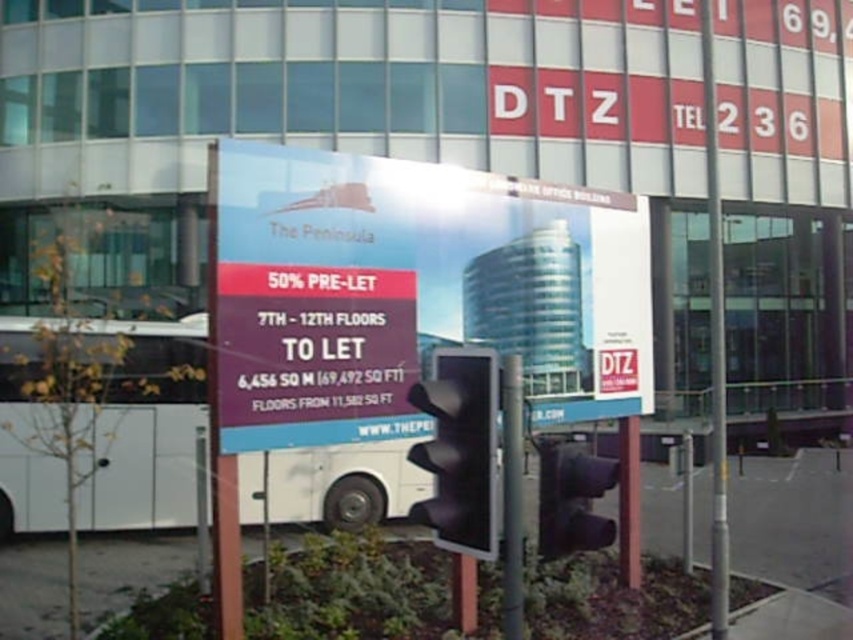
What do you see at coordinates (415, 292) in the screenshot? I see `white glossy billboard at center` at bounding box center [415, 292].

At what (x,y) coordinates should I click in order to perform the action: click on white glossy billboard at center. Please return your answer as a coordinate pair (x, y). Looking at the image, I should click on (415, 292).

Does point (346, 264) lie in front of point (717, 554)?

Yes, point (346, 264) is in front of point (717, 554).

This screenshot has height=640, width=853. Identify the location of white glossy billboard at center. (415, 292).

Is silver metallic pole at center closer to the viewer compared to matte black traffic light at center?

No, it is behind matte black traffic light at center.

Can you confirm if silver metallic pole at center is smaller than matte black traffic light at center?

Incorrect, silver metallic pole at center is not smaller in size than matte black traffic light at center.

Which is behind, point (706, 120) or point (546, 467)?

The point (706, 120) is more distant.

At what (x,y) coordinates should I click in order to perform the action: click on silver metallic pole at center. Please return your answer as a coordinate pair (x, y). Looking at the image, I should click on (715, 340).

Who is more distant from viewer, (x=566, y=285) or (x=496, y=387)?

Positioned behind is point (x=566, y=285).

Measure the distance between white glossy billboard at center and black matte traffic light at center.

10.55 feet

Is point (231, 148) positioned behind point (433, 360)?

Yes, it is.

Where is `white glossy billboard at center`? The width and height of the screenshot is (853, 640). white glossy billboard at center is located at coordinates (415, 292).